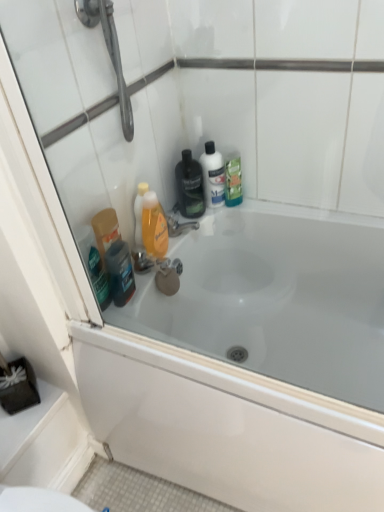
Question: From a real-world perspective, is metallic chrome faucet at center physically below shiny dark blue bottle at lower left?

Choices:
 (A) no
 (B) yes

Answer: (B)

Question: Is metallic chrome faucet at center positioned in front of shiny dark blue bottle at lower left?

Choices:
 (A) no
 (B) yes

Answer: (A)

Question: Considering the relative sizes of metallic chrome faucet at center and shiny dark blue bottle at lower left in the image provided, is metallic chrome faucet at center thinner than shiny dark blue bottle at lower left?

Choices:
 (A) yes
 (B) no

Answer: (B)

Question: Considering the relative sizes of metallic chrome faucet at center and shiny dark blue bottle at lower left in the image provided, is metallic chrome faucet at center taller than shiny dark blue bottle at lower left?

Choices:
 (A) no
 (B) yes

Answer: (A)

Question: Is metallic chrome faucet at center behind shiny dark blue bottle at lower left?

Choices:
 (A) no
 (B) yes

Answer: (B)

Question: Is metallic chrome faucet at center facing away from shiny dark blue bottle at lower left?

Choices:
 (A) yes
 (B) no

Answer: (B)

Question: From a real-world perspective, is white glossy mouthwash at center, the 3th mouthwash when ordered from left to right, located beneath shiny dark blue bottle at lower left?

Choices:
 (A) no
 (B) yes

Answer: (A)

Question: Is white glossy mouthwash at center, arranged as the 2th mouthwash when viewed from the right, surrounding shiny dark blue bottle at lower left?

Choices:
 (A) no
 (B) yes

Answer: (A)

Question: Are white glossy mouthwash at center, the 3th mouthwash when ordered from left to right, and shiny dark blue bottle at lower left far apart?

Choices:
 (A) yes
 (B) no

Answer: (B)

Question: Can you confirm if white glossy mouthwash at center, the 3th mouthwash when ordered from left to right, is wider than shiny dark blue bottle at lower left?

Choices:
 (A) yes
 (B) no

Answer: (A)

Question: Considering the relative positions of white glossy mouthwash at center, arranged as the 2th mouthwash when viewed from the right, and shiny dark blue bottle at lower left in the image provided, is white glossy mouthwash at center, arranged as the 2th mouthwash when viewed from the right, in front of shiny dark blue bottle at lower left?

Choices:
 (A) no
 (B) yes

Answer: (A)

Question: Is white glossy mouthwash at center, arranged as the 2th mouthwash when viewed from the right, facing towards shiny dark blue bottle at lower left?

Choices:
 (A) yes
 (B) no

Answer: (B)

Question: From a real-world perspective, is metallic chrome faucet at center beneath white glossy mouthwash at center, arranged as the 2th mouthwash when viewed from the right?

Choices:
 (A) yes
 (B) no

Answer: (A)